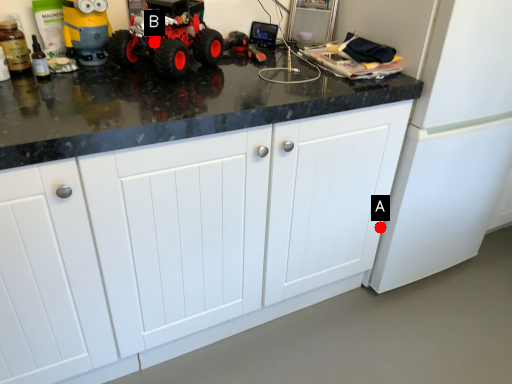
Question: Two points are circled on the image, labeled by A and B beside each circle. Which point appears farthest from the camera in this image?

Choices:
 (A) A is further
 (B) B is further

Answer: (A)